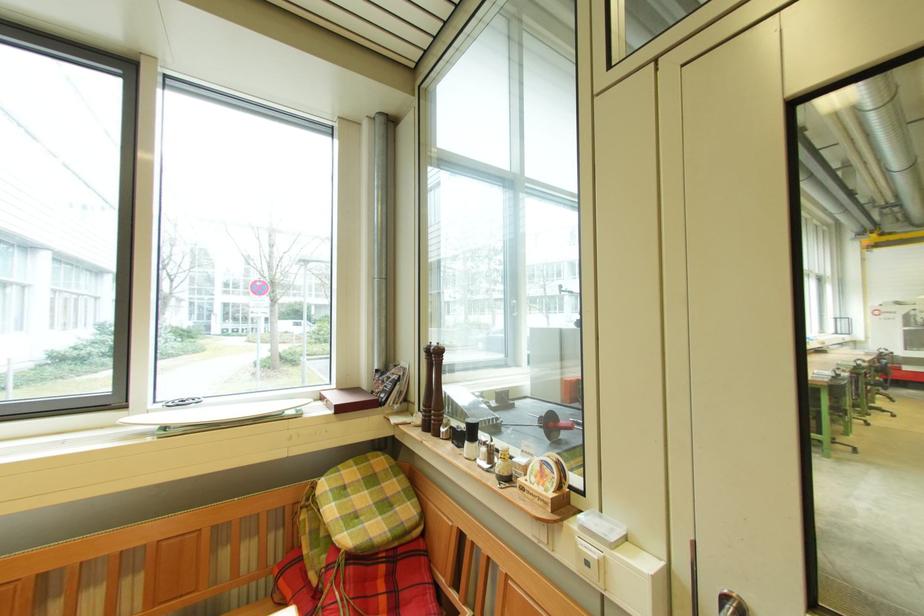
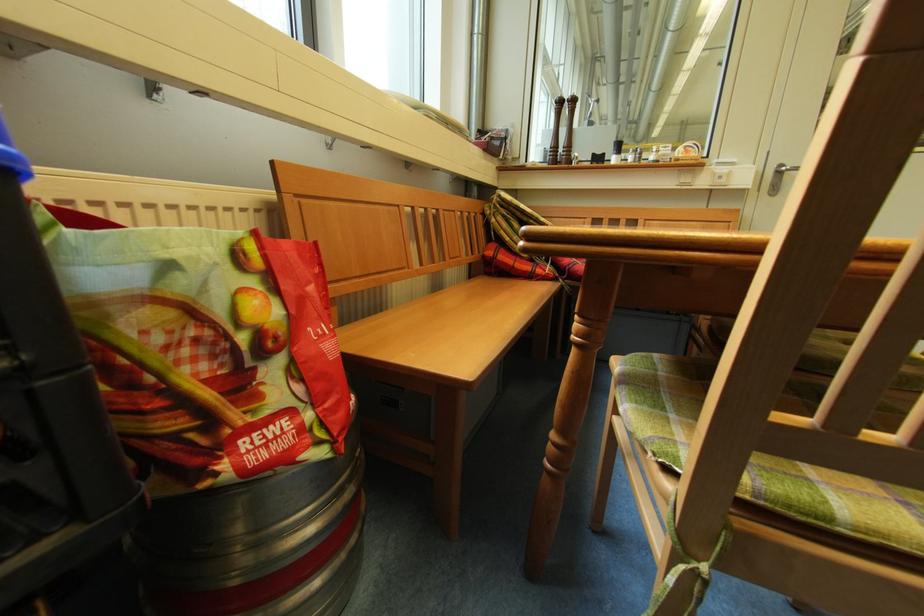
The point at (590, 496) is marked in the first image. Where is the corresponding point in the second image?

(714, 160)